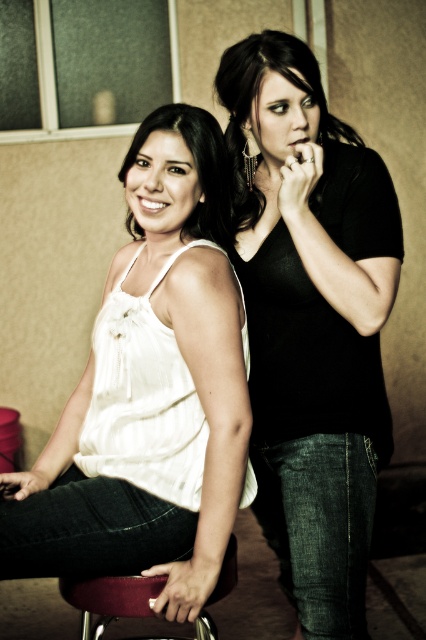
You are trying to decide which top to wear for a photoshoot. You have a black matte shirt at center and a white ribbed tank top at left. Based on their sizes, which one might be more suitable for a slim fit look?

The black matte shirt at center has a lesser width compared to the white ribbed tank top at left, making it more suitable for a slim fit look.

You are designing a layout for a clothing catalog and need to place the black matte shirt at center and the velvet maroon bar stool at lower center. Given their sizes, which object should be placed closer to the camera to maintain visual balance?

The black matte shirt at center is bigger than the velvet maroon bar stool at lower center, so to maintain visual balance, the velvet maroon bar stool at lower center should be placed closer to the camera while the black matte shirt at center is positioned further back.

You are standing in the room and want to reach the point marked at coordinates (x=242, y=40). If your arm can reach 1.4 meters, can you touch that point without moving your feet?

The point at coordinates (x=242, y=40) is 1.43 meters away from the viewer. Since your arm can only reach 1.4 meters, you cannot touch the point without moving your feet.